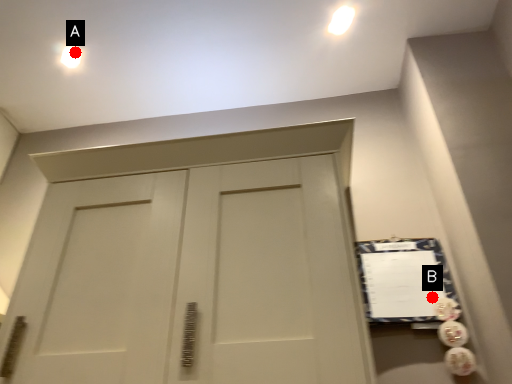
Question: Two points are circled on the image, labeled by A and B beside each circle. Which of the following is the closest to the observer?

Choices:
 (A) A is closer
 (B) B is closer

Answer: (B)